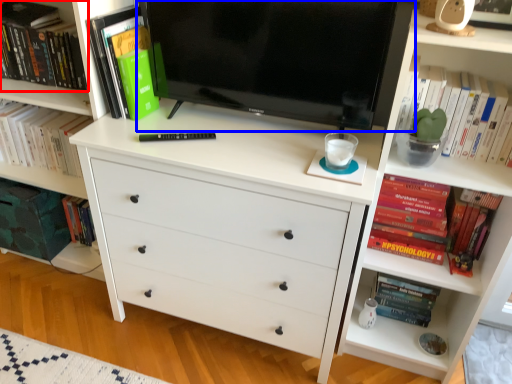
Question: Which object is closer to the camera taking this photo, book (highlighted by a red box) or television (highlighted by a blue box)?

Choices:
 (A) book
 (B) television

Answer: (B)